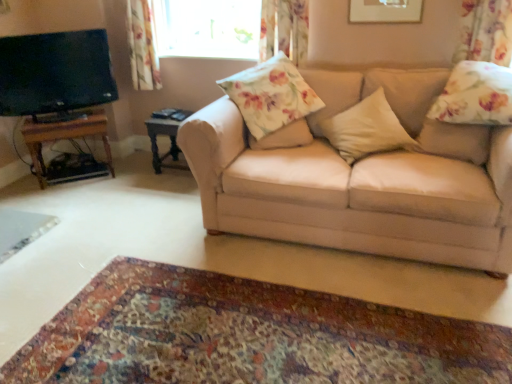
Question: Considering their positions, is beige fabric pillow at center, the second pillow from the right, located in front of or behind floral fabric pillow at right, the 3th pillow positioned from the left?

Choices:
 (A) behind
 (B) front

Answer: (A)

Question: Is beige fabric pillow at center, the second pillow from the right, taller or shorter than floral fabric pillow at right, placed as the first pillow when sorted from right to left?

Choices:
 (A) tall
 (B) short

Answer: (A)

Question: Which object is the closest to the beige fabric couch at center?

Choices:
 (A) floral fabric pillow at center
 (B) dark wood side table at center, marked as the first table in a right-to-left arrangement
 (C) matte black tv at left
 (D) carpet at lower center
 (E) floral fabric curtain at upper right, placed as the third curtain when sorted from back to front

Answer: (A)

Question: Estimate the real-world distances between objects in this image. Which object is farther from the beige fabric couch at center?

Choices:
 (A) beige fabric pillow at center, positioned as the second pillow in left-to-right order
 (B) dark wood side table at center, which is counted as the second table, starting from the left
 (C) matte black tv at left
 (D) wooden table at left, which ranks as the 2th table in right-to-left order
 (E) floral fabric pillow at center

Answer: (D)